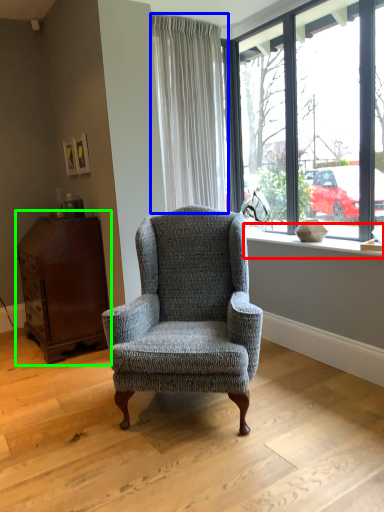
Question: Based on their relative distances, which object is nearer to window sill (highlighted by a red box)? Choose from curtain (highlighted by a blue box) and dresser (highlighted by a green box).

Choices:
 (A) curtain
 (B) dresser

Answer: (A)